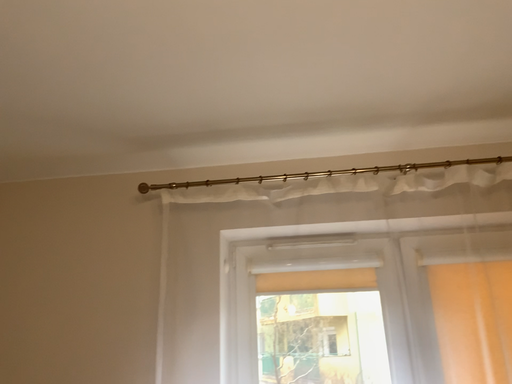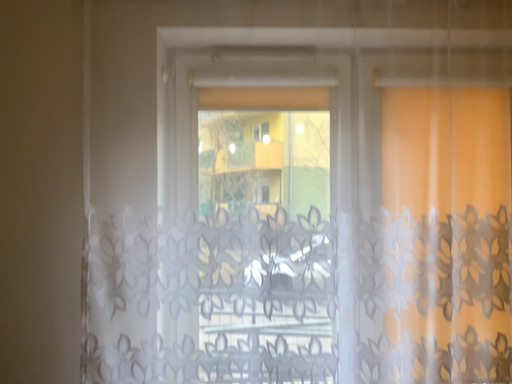
Question: Which way did the camera rotate in the video?

Choices:
 (A) rotated upward
 (B) rotated downward

Answer: (B)